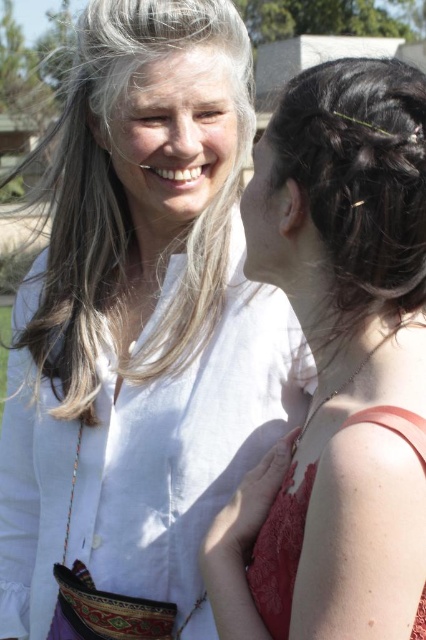
What do you see at coordinates (184, 442) in the screenshot? I see `white linen shirt at upper center` at bounding box center [184, 442].

This screenshot has width=426, height=640. What are the coordinates of `white linen shirt at upper center` in the screenshot? It's located at [x=184, y=442].

The image size is (426, 640). Identify the location of white linen shirt at upper center. (184, 442).

Is matte white blouse at upper center further to the viewer compared to white linen shirt at upper center?

That is False.

Which is in front, point (417, 365) or point (253, 323)?

Point (417, 365)

Does point (270, 541) come farther from viewer compared to point (172, 508)?

No, it is not.

Where is `matte white blouse at upper center`? matte white blouse at upper center is located at coordinates (337, 368).

Who is more forward, (72, 83) or (294, 544)?

Positioned in front is point (294, 544).

Who is more distant from viewer, (193, 237) or (288, 556)?

Point (193, 237)

Locate an element on the screen. The image size is (426, 640). gray smooth hair at upper left is located at coordinates (126, 204).